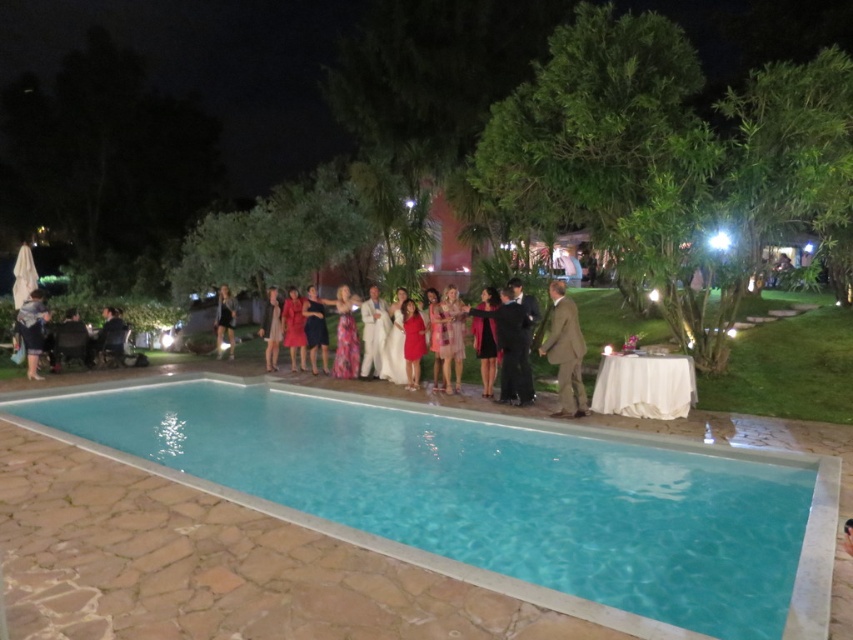
Looking at this image, is satin brown suit at center to the left of denim jacket at lower left from the viewer's perspective?

In fact, satin brown suit at center is to the right of denim jacket at lower left.

Which is in front, point (561, 291) or point (35, 317)?

Point (561, 291)

Find the location of a particular element. The height and width of the screenshot is (640, 853). satin brown suit at center is located at coordinates (566, 353).

Between clear blue water at center and satin brown suit at center, which one is positioned lower?

clear blue water at center is below.

Who is more forward, (245,522) or (560,346)?

Point (245,522)

You are a GUI agent. You are given a task and a screenshot of the screen. Output one action in this format:
    pyautogui.click(x=<x>, y=<y>)
    Task: Click on the clear blue water at center
    The image size is (853, 640).
    Given the screenshot: What is the action you would take?
    pyautogui.click(x=492, y=496)

Can you confirm if satin brown suit at center is thinner than shiny black dress at center?

Correct, satin brown suit at center's width is less than shiny black dress at center's.

What do you see at coordinates (566, 353) in the screenshot? The width and height of the screenshot is (853, 640). I see `satin brown suit at center` at bounding box center [566, 353].

Identify the location of satin brown suit at center. (566, 353).